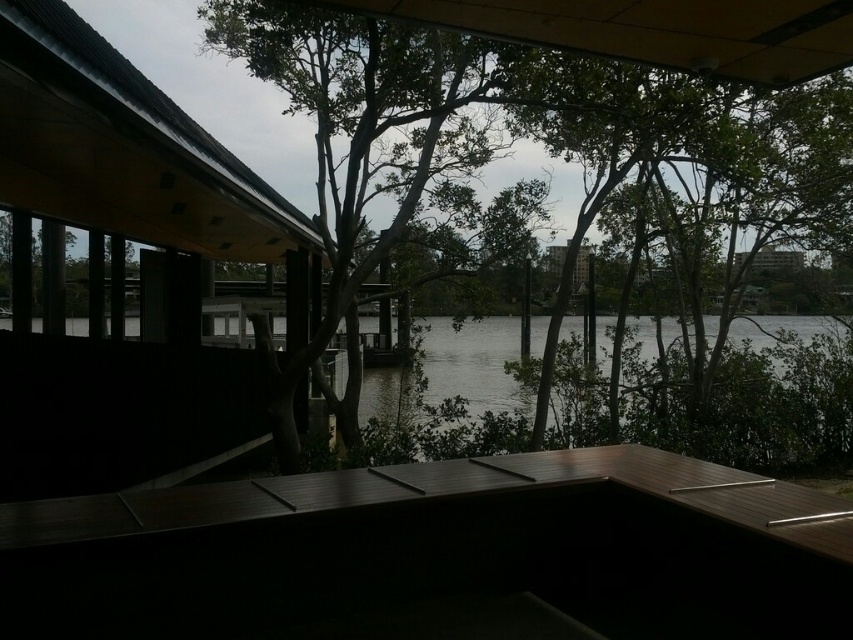
You are standing on the deck of the modern structure and want to walk towards the point labeled point (764, 600). Will you pass by point (578, 8) on your way there?

Yes, because point (764, 600) is in front of point (578, 8), so you will pass by point (578, 8) on your way to point (764, 600).

You are an architect designing a new riverside pavilion. You want to ensure that the dark wood deck at center and the green leafy tree at center are both visible from the main viewing area. Based on their sizes, which object should be placed closer to the viewing area to maintain balance?

The dark wood deck at center is larger in size than the green leafy tree at center. To maintain balance, the smaller green leafy tree at center should be placed closer to the viewing area while the larger dark wood deck at center can be positioned further back.